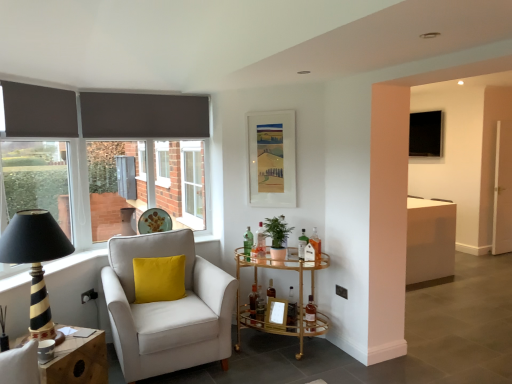
Question: Considering the positions of translucent glass bottle at center, which appears as the second bottle when viewed from the left, and gold glass bar cart at center, the 2th table positioned from the left, in the image, is translucent glass bottle at center, which appears as the second bottle when viewed from the left, wider or thinner than gold glass bar cart at center, the 2th table positioned from the left,?

Choices:
 (A) wide
 (B) thin

Answer: (B)

Question: Considering the positions of translucent glass bottle at center, the 6th bottle in the right-to-left sequence, and gold glass bar cart at center, which ranks as the second table in front-to-back order, in the image, is translucent glass bottle at center, the 6th bottle in the right-to-left sequence, bigger or smaller than gold glass bar cart at center, which ranks as the second table in front-to-back order,?

Choices:
 (A) big
 (B) small

Answer: (B)

Question: Based on their relative distances, which object is farther from the matte gray roller blind at left?

Choices:
 (A) black plastic power outlet at lower left, the first power outlet in the left-to-right sequence
 (B) white plastic window frame at center
 (C) black glossy television at upper right
 (D) white fabric armchair at left
 (E) translucent glass bottle at center, the 6th bottle in the right-to-left sequence

Answer: (C)

Question: Estimate the real-world distances between objects in this image. Which object is farther from the matte gray roller blind at left?

Choices:
 (A) matte paper picture frame at center
 (B) translucent glass bottle at center, the first bottle from the right
 (C) black plastic power outlet at lower left, the first power outlet in the left-to-right sequence
 (D) black plastic power outlet at lower right, placed as the 1th power outlet when sorted from right to left
 (E) green glass bottle at center, the fifth bottle in the left-to-right sequence

Answer: (D)